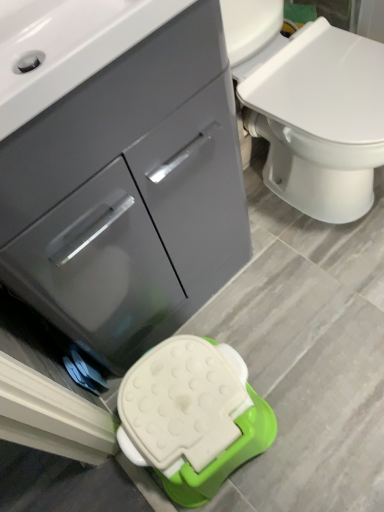
Based on the photo, measure the distance between white glossy sink at upper left and camera.

They are 21.01 inches apart.

What do you see at coordinates (67, 46) in the screenshot? This screenshot has width=384, height=512. I see `white glossy sink at upper left` at bounding box center [67, 46].

I want to click on matte gray cabinet at center, so click(118, 167).

Does matte gray cabinet at center have a greater height compared to white plastic stool at lower center?

Yes, matte gray cabinet at center is taller than white plastic stool at lower center.

From the picture: How far apart are matte gray cabinet at center and white plastic stool at lower center?

A distance of 33.07 centimeters exists between matte gray cabinet at center and white plastic stool at lower center.

Visually, is matte gray cabinet at center positioned to the left or to the right of white plastic stool at lower center?

In the image, matte gray cabinet at center appears on the left side of white plastic stool at lower center.

Considering the sizes of objects matte gray cabinet at center and white plastic stool at lower center in the image provided, who is smaller, matte gray cabinet at center or white plastic stool at lower center?

With smaller size is white plastic stool at lower center.

From the image's perspective, is white glossy sink at upper left below white plastic stool at lower center?

No, from the image's perspective, white glossy sink at upper left is not beneath white plastic stool at lower center.

From a real-world perspective, is white glossy sink at upper left below white plastic stool at lower center?

Incorrect, from a real-world perspective, white glossy sink at upper left is higher than white plastic stool at lower center.

Is white glossy sink at upper left oriented towards white plastic stool at lower center?

No, white glossy sink at upper left is not oriented towards white plastic stool at lower center.

In the image, is white glossy sink at upper left on the left side or the right side of white plastic stool at lower center?

Based on their positions, white glossy sink at upper left is located to the left of white plastic stool at lower center.

From a real-world perspective, is white plastic stool at lower center positioned above or below matte gray cabinet at center?

Clearly, from a real-world perspective, white plastic stool at lower center is below matte gray cabinet at center.

Would you say matte gray cabinet at center is part of white plastic stool at lower center's contents?

No, white plastic stool at lower center does not contain matte gray cabinet at center.

Are white plastic stool at lower center and matte gray cabinet at center making contact?

white plastic stool at lower center is not next to matte gray cabinet at center, and they're not touching.

Which is behind, white plastic stool at lower center or matte gray cabinet at center?

white plastic stool at lower center is more distant.

Does white plastic stool at lower center have a greater height compared to white glossy sink at upper left?

Indeed, white plastic stool at lower center has a greater height compared to white glossy sink at upper left.

From a real-world perspective, is white plastic stool at lower center under white glossy sink at upper left?

Indeed, from a real-world perspective, white plastic stool at lower center is positioned beneath white glossy sink at upper left.

Considering the sizes of objects white plastic stool at lower center and white glossy sink at upper left in the image provided, who is thinner, white plastic stool at lower center or white glossy sink at upper left?

white plastic stool at lower center.

Is white plastic stool at lower center located outside white glossy sink at upper left?

white plastic stool at lower center is positioned outside white glossy sink at upper left.

Considering the relative sizes of white glossy sink at upper left and matte gray cabinet at center in the image provided, is white glossy sink at upper left bigger than matte gray cabinet at center?

Actually, white glossy sink at upper left might be smaller than matte gray cabinet at center.

Is white glossy sink at upper left facing away from matte gray cabinet at center?

No.

From a real-world perspective, does white glossy sink at upper left stand above matte gray cabinet at center?

Yes, from a real-world perspective, white glossy sink at upper left is on top of matte gray cabinet at center.

From the image's perspective, who appears lower, matte gray cabinet at center or white glossy sink at upper left?

matte gray cabinet at center is shown below in the image.

Considering the relative positions of matte gray cabinet at center and white glossy sink at upper left in the image provided, is matte gray cabinet at center to the left or to the right of white glossy sink at upper left?

Based on their positions, matte gray cabinet at center is located to the right of white glossy sink at upper left.

How far apart are matte gray cabinet at center and white glossy sink at upper left?

matte gray cabinet at center is 9.95 inches away from white glossy sink at upper left.

Considering the sizes of objects matte gray cabinet at center and white glossy sink at upper left in the image provided, who is shorter, matte gray cabinet at center or white glossy sink at upper left?

white glossy sink at upper left.

Locate an element on the screen. bathroom cabinet above the white plastic stool at lower center (from a real-world perspective) is located at coordinates (118, 167).

You are a GUI agent. You are given a task and a screenshot of the screen. Output one action in this format:
    pyautogui.click(x=<x>, y=<y>)
    Task: Click on the sink lying in front of the white plastic stool at lower center
    Image resolution: width=384 pixels, height=512 pixels.
    Given the screenshot: What is the action you would take?
    pyautogui.click(x=67, y=46)

Which object lies further to the anchor point white glossy sink at upper left, matte gray cabinet at center or white plastic stool at lower center?

white plastic stool at lower center is further to white glossy sink at upper left.

Based on their spatial positions, is white plastic stool at lower center or white glossy sink at upper left further from matte gray cabinet at center?

white plastic stool at lower center is positioned further to the anchor matte gray cabinet at center.

Estimate the real-world distances between objects in this image. Which object is closer to white plastic stool at lower center, white glossy sink at upper left or matte gray cabinet at center?

matte gray cabinet at center is closer to white plastic stool at lower center.

When comparing their distances from matte gray cabinet at center, does white glossy sink at upper left or white plastic stool at lower center seem further?

white plastic stool at lower center is positioned further to the anchor matte gray cabinet at center.

Looking at the image, which one is located closer to white glossy sink at upper left, white plastic stool at lower center or matte gray cabinet at center?

Among the two, matte gray cabinet at center is located nearer to white glossy sink at upper left.

Which object lies further to the anchor point white plastic stool at lower center, matte gray cabinet at center or white glossy sink at upper left?

white glossy sink at upper left is positioned further to the anchor white plastic stool at lower center.

The height and width of the screenshot is (512, 384). Find the location of `bathroom cabinet between white glossy sink at upper left and white plastic stool at lower center vertically`. bathroom cabinet between white glossy sink at upper left and white plastic stool at lower center vertically is located at coordinates (118, 167).